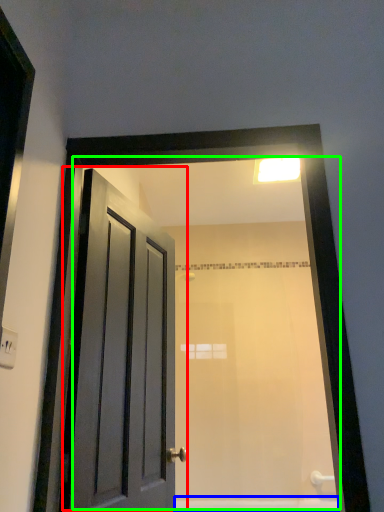
Question: Considering the real-world distances, which object is farthest from door (highlighted by a red box)? bath (highlighted by a blue box) or mirror (highlighted by a green box)?

Choices:
 (A) bath
 (B) mirror

Answer: (A)